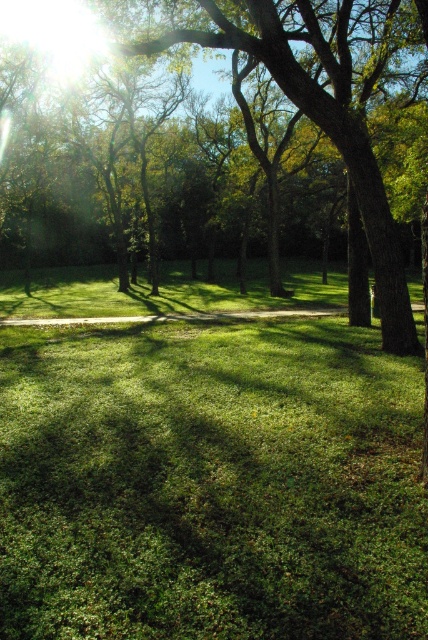
Question: Can you confirm if green grassy at center is smaller than green leafy tree at center?

Choices:
 (A) yes
 (B) no

Answer: (A)

Question: Can you confirm if green grassy at center is positioned above green leafy tree at center?

Choices:
 (A) yes
 (B) no

Answer: (B)

Question: Does green grassy at center appear over green leafy tree at center?

Choices:
 (A) yes
 (B) no

Answer: (B)

Question: Which object is closer to the camera taking this photo?

Choices:
 (A) green leafy tree at center
 (B) green grassy at center

Answer: (B)